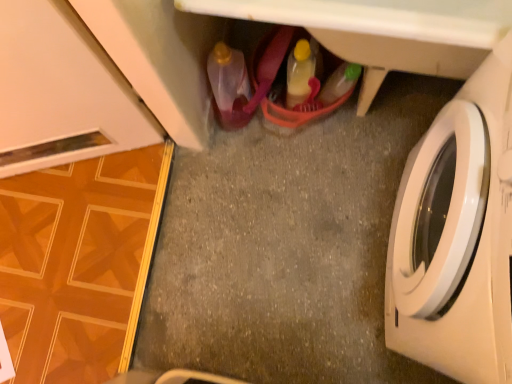
Question: Is point (474, 370) positioned closer to the camera than point (246, 87)?

Choices:
 (A) closer
 (B) farther

Answer: (A)

Question: Considering the positions of white glossy washing machine at right and translucent plastic bottle at lower center, which is the 1th bottle in left-to-right order, in the image, is white glossy washing machine at right taller or shorter than translucent plastic bottle at lower center, which is the 1th bottle in left-to-right order,?

Choices:
 (A) short
 (B) tall

Answer: (B)

Question: Based on their relative distances, which object is nearer to the smooth gray concrete at center?

Choices:
 (A) translucent plastic bottle at lower center, arranged as the 2th bottle when viewed from the right
 (B) white glossy washing machine at right
 (C) white plastic cabinet at center
 (D) translucent yellow plastic bottle at center, which is the second bottle in left-to-right order

Answer: (A)

Question: Based on their relative distances, which object is nearer to the white plastic cabinet at center?

Choices:
 (A) translucent yellow plastic bottle at center, which appears as the first bottle when viewed from the right
 (B) translucent plastic bottle at lower center, which is the 1th bottle in left-to-right order
 (C) white glossy washing machine at right
 (D) smooth gray concrete at center

Answer: (A)